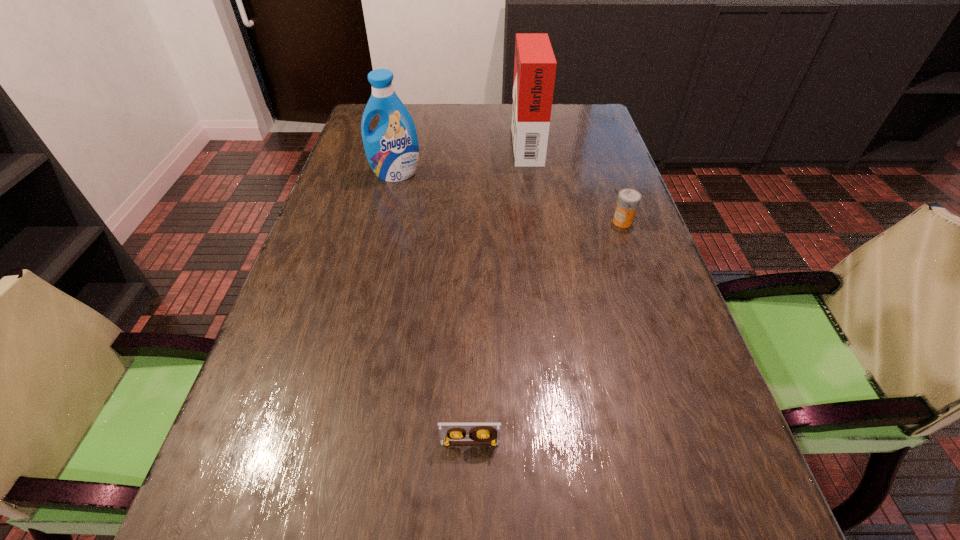
Where is `free space located 0.260m on the front-facing side of the second object from right to left`? free space located 0.260m on the front-facing side of the second object from right to left is located at coordinates (428, 143).

At what (x,y) coordinates should I click in order to perform the action: click on vacant space situated on the front-facing side of the leftmost object. Please return your answer as a coordinate pair (x, y). Image resolution: width=960 pixels, height=540 pixels. Looking at the image, I should click on [383, 225].

Locate an element on the screen. The height and width of the screenshot is (540, 960). vacant region located on the label side of the third farthest object is located at coordinates (460, 222).

Image resolution: width=960 pixels, height=540 pixels. Find the location of `vacant space located on the label side of the third farthest object`. vacant space located on the label side of the third farthest object is located at coordinates (508, 222).

I want to click on free location located on the label side of the third farthest object, so click(464, 222).

The height and width of the screenshot is (540, 960). I want to click on free space located 0.080m at the front of the shortest object with visible reels, so click(469, 500).

This screenshot has width=960, height=540. What are the coordinates of `object situated at the far edge` in the screenshot? It's located at (535, 65).

In order to click on object at the left edge in this screenshot , I will do `click(392, 150)`.

Locate an element on the screen. object that is at the right edge is located at coordinates (628, 200).

Identify the location of free space at the far edge of the desktop. This screenshot has height=540, width=960. (436, 109).